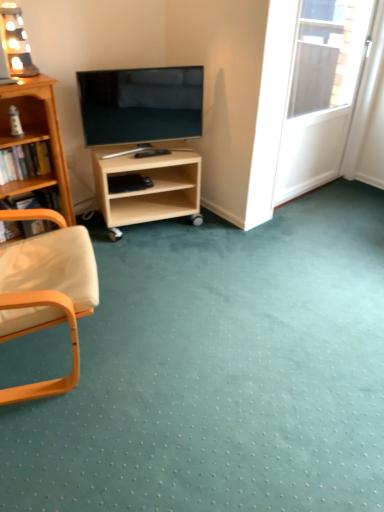
Question: Can you confirm if light wood/unfinishedobject at center is bigger than wooden armchair at left?

Choices:
 (A) no
 (B) yes

Answer: (A)

Question: Is wooden armchair at left inside light wood/unfinishedobject at center?

Choices:
 (A) yes
 (B) no

Answer: (B)

Question: Can you confirm if light wood/unfinishedobject at center is shorter than wooden armchair at left?

Choices:
 (A) no
 (B) yes

Answer: (B)

Question: Does light wood/unfinishedobject at center have a greater height compared to wooden armchair at left?

Choices:
 (A) yes
 (B) no

Answer: (B)

Question: Is wooden armchair at left at the back of light wood/unfinishedobject at center?

Choices:
 (A) yes
 (B) no

Answer: (B)

Question: From the image's perspective, is wooden chair arm at left, which is counted as the second book, starting from the top, located above or below wooden lamp at upper left?

Choices:
 (A) below
 (B) above

Answer: (A)

Question: In terms of width, does wooden chair arm at left, which is counted as the second book, starting from the top, look wider or thinner when compared to wooden lamp at upper left?

Choices:
 (A) wide
 (B) thin

Answer: (A)

Question: Is point (38, 203) closer or farther from the camera than point (29, 53)?

Choices:
 (A) farther
 (B) closer

Answer: (A)

Question: Considering their positions, is wooden chair arm at left, which is counted as the second book, starting from the top, located in front of or behind wooden lamp at upper left?

Choices:
 (A) behind
 (B) front

Answer: (A)

Question: In terms of height, does matte black tv at center look taller or shorter compared to wooden bookshelf at left, the 2th book when ordered from bottom to top?

Choices:
 (A) short
 (B) tall

Answer: (B)

Question: From the image's perspective, relative to wooden bookshelf at left, which is counted as the first book, starting from the top, is matte black tv at center above or below?

Choices:
 (A) below
 (B) above

Answer: (B)

Question: Considering the relative positions of matte black tv at center and wooden bookshelf at left, which is counted as the first book, starting from the top, in the image provided, is matte black tv at center to the left or to the right of wooden bookshelf at left, which is counted as the first book, starting from the top,?

Choices:
 (A) right
 (B) left

Answer: (A)

Question: Is point (132, 115) closer or farther from the camera than point (39, 163)?

Choices:
 (A) closer
 (B) farther

Answer: (B)

Question: From their relative heights in the image, would you say wooden lamp at upper left is taller or shorter than wooden armchair at left?

Choices:
 (A) tall
 (B) short

Answer: (B)

Question: Looking at their shapes, would you say wooden lamp at upper left is wider or thinner than wooden armchair at left?

Choices:
 (A) wide
 (B) thin

Answer: (B)